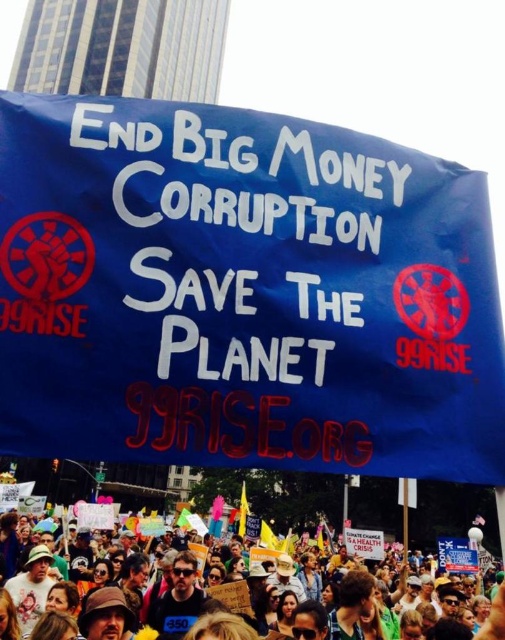
Does blue fabric banner at center lie in front of blue fabric crowd at lower center?

No, blue fabric banner at center is behind blue fabric crowd at lower center.

You are a GUI agent. You are given a task and a screenshot of the screen. Output one action in this format:
    pyautogui.click(x=<x>, y=<y>)
    Task: Click on the blue fabric banner at center
    
    Given the screenshot: What is the action you would take?
    pyautogui.click(x=242, y=292)

Who is more distant from viewer, (321, 323) or (480, 538)?

Point (480, 538)

Where is `blue fabric banner at center`? This screenshot has height=640, width=505. blue fabric banner at center is located at coordinates (242, 292).